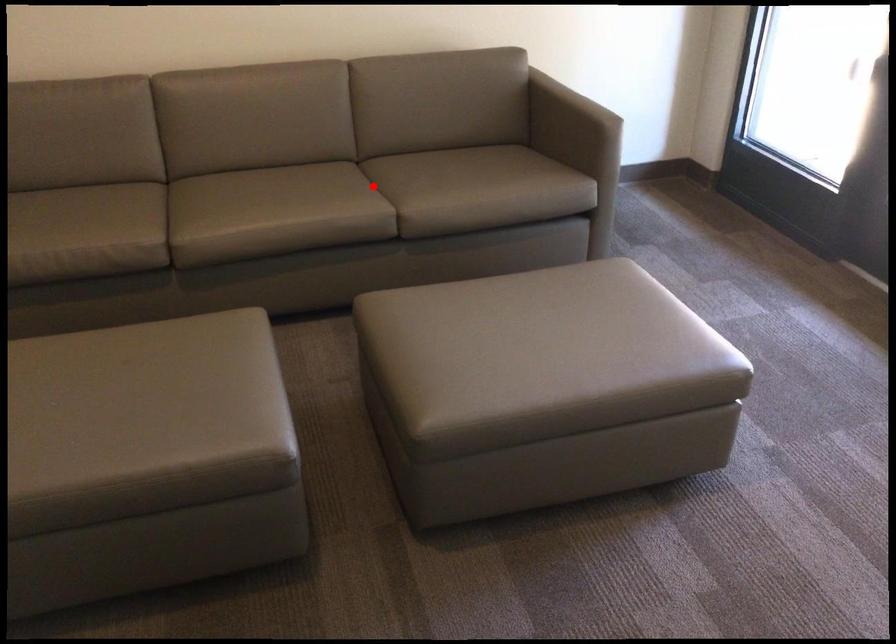
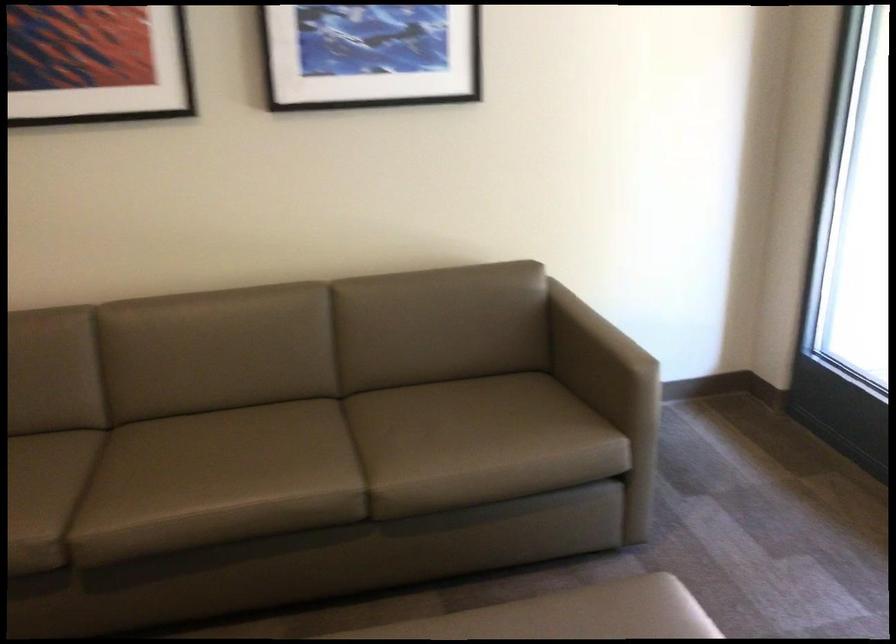
Question: I am providing you with two images of the same scene from different viewpoints. In image1, a red point is highlighted. Considering the same 3D point in image2, which of the following is correct?

Choices:
 (A) It is closer
 (B) It is farther

Answer: (A)